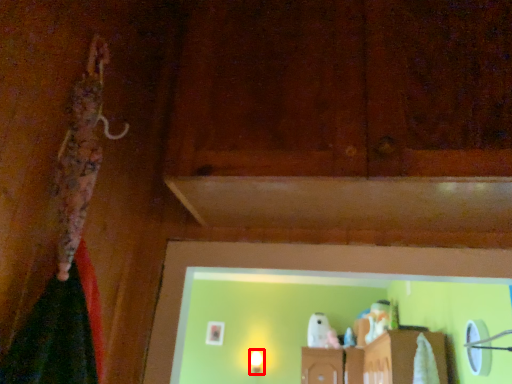
Question: From the image's perspective, what is the correct spatial positioning of light fixture (annotated by the red box) in reference to wood?

Choices:
 (A) below
 (B) above

Answer: (A)